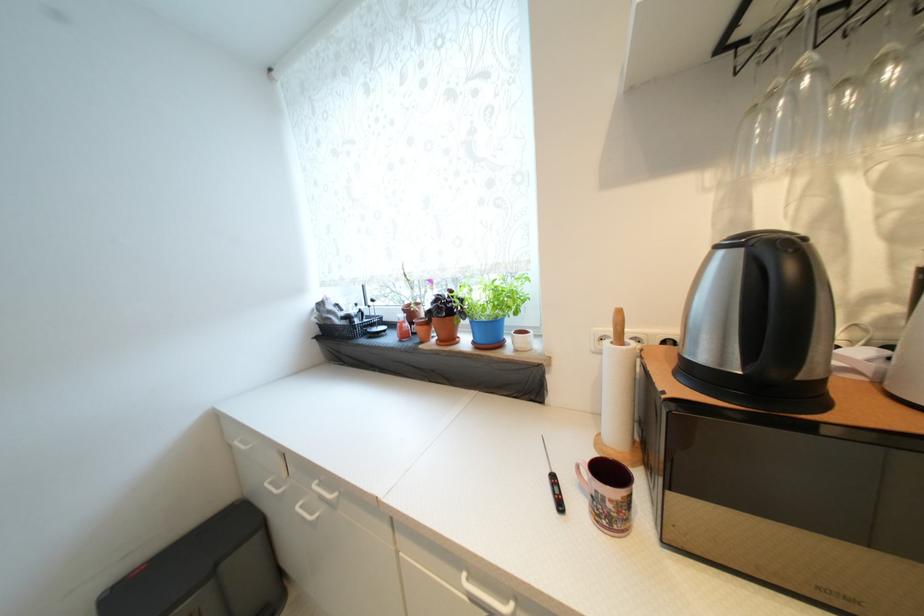
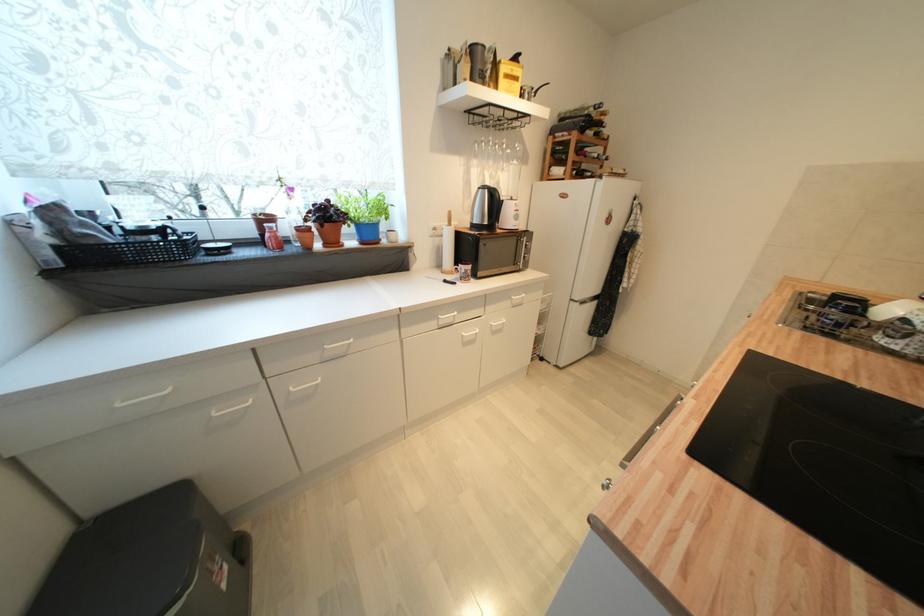
The point at (613,345) is marked in the first image. Where is the corresponding point in the second image?

(450, 229)